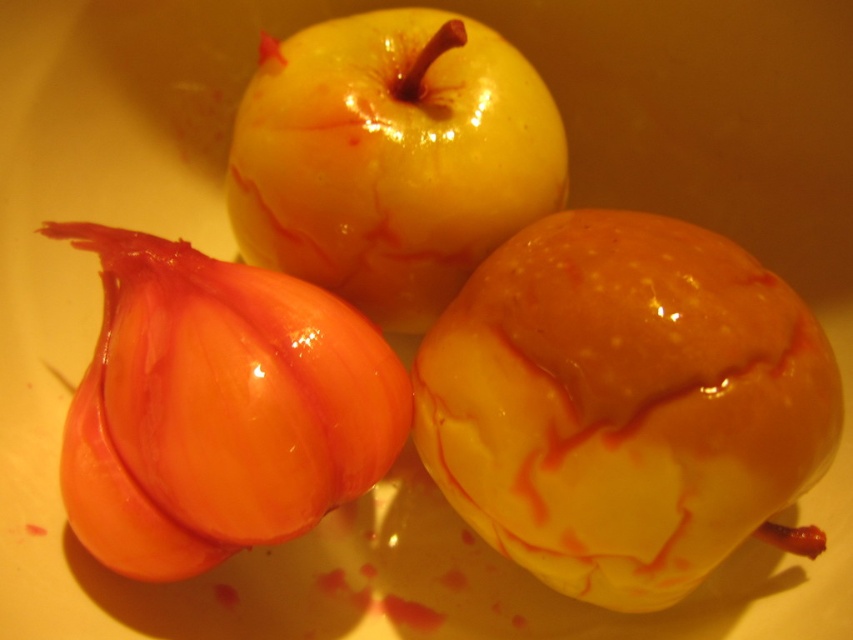
You are arranging a fruit platter and need to place the shiny orange onion at lower left and the yellow shiny apple at center in a specific order. According to the image, which object is positioned to the left of the other?

The shiny orange onion at lower left is to the left of yellow shiny apple at center.

You are arranging a fruit platter and need to place the shiny orange onion at lower left and the yellow shiny apple at center. Based on their positions, which fruit is closer to the edge of the plate?

The shiny orange onion at lower left is closer to the edge of the plate because it is positioned below the yellow shiny apple at center, which is centrally located.